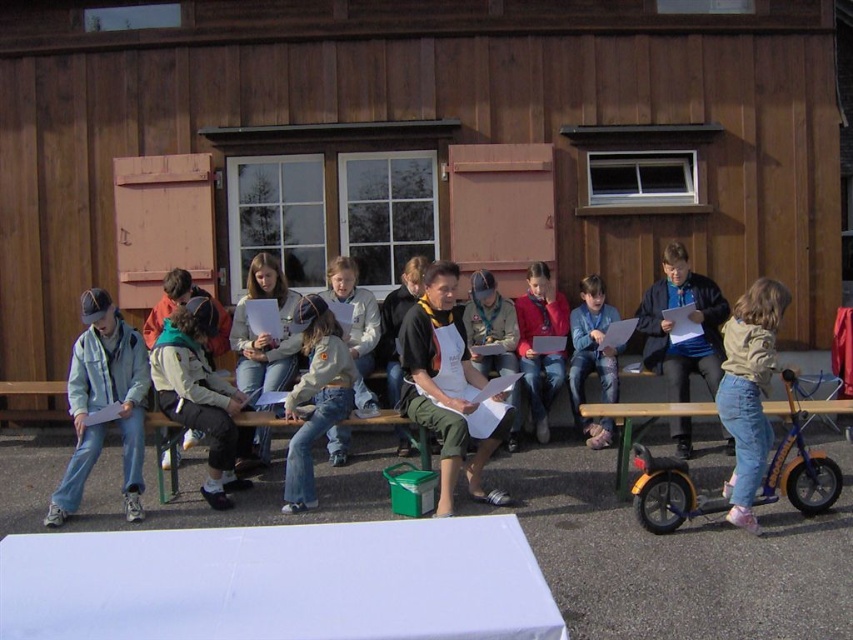
Question: Is white cloth-covered table at lower center to the right of matte blue jacket at center from the viewer's perspective?

Choices:
 (A) no
 (B) yes

Answer: (A)

Question: Which object is the closest to the wooden bench at center?

Choices:
 (A) white cloth-covered table at lower center
 (B) jeans at center

Answer: (B)

Question: Can you confirm if denim jacket at left is smaller than orange plastic picnic table at lower right?

Choices:
 (A) yes
 (B) no

Answer: (B)

Question: Can you confirm if light brown denim jeans at lower right is positioned to the left of matte blue jacket at center?

Choices:
 (A) yes
 (B) no

Answer: (B)

Question: Which point is farther to the camera?

Choices:
 (A) (640, 410)
 (B) (287, 452)
 (C) (648, 252)
 (D) (216, 486)

Answer: (C)

Question: Among these objects, which one is nearest to the camera?

Choices:
 (A) denim jacket at left
 (B) wooden bench at center

Answer: (A)